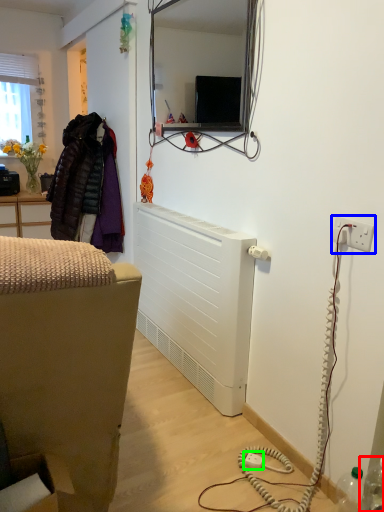
Question: Based on their relative distances, which object is nearer to bottle (highlighted by a red box)? Choose from electric outlet (highlighted by a blue box) and plug (highlighted by a green box).

Choices:
 (A) electric outlet
 (B) plug

Answer: (B)